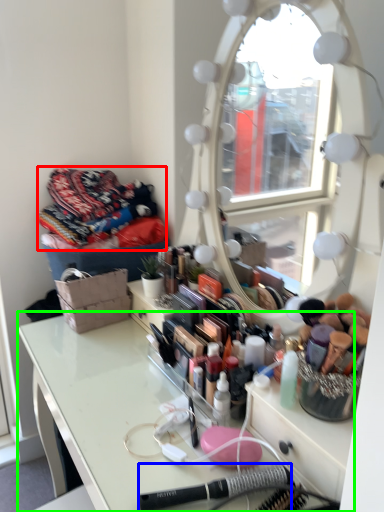
Question: Which object is positioned closest to clothing (highlighted by a red box)? Select from equipment (highlighted by a blue box) and table (highlighted by a green box).

Choices:
 (A) equipment
 (B) table

Answer: (B)